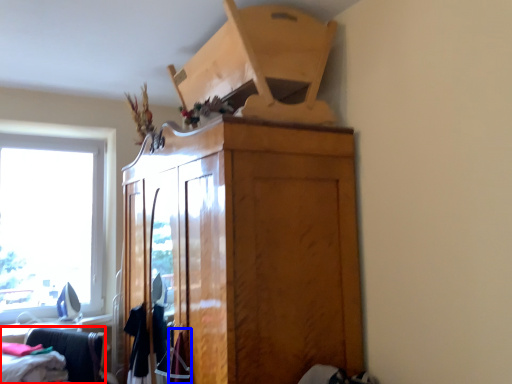
Question: Which object appears closest to the camera in this image, furniture (highlighted by a red box) or clothing (highlighted by a blue box)?

Choices:
 (A) furniture
 (B) clothing

Answer: (B)